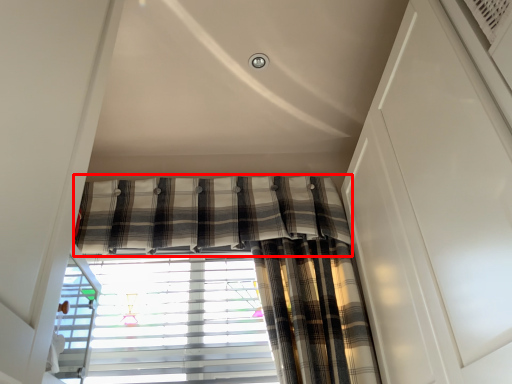
Question: From the image's perspective, considering the relative positions of curtain (annotated by the red box) and window blind in the image provided, where is curtain (annotated by the red box) located with respect to the staircase?

Choices:
 (A) above
 (B) below

Answer: (A)